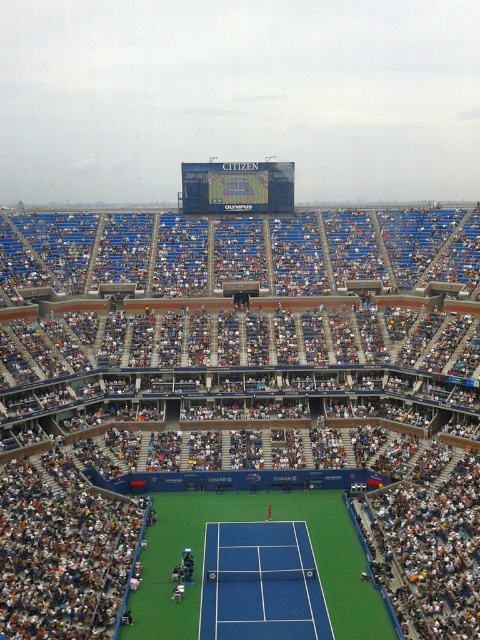
Is blue synthetic turf tennis court at center to the right of blue synthetic turf at center from the viewer's perspective?

Indeed, blue synthetic turf tennis court at center is positioned on the right side of blue synthetic turf at center.

Is blue synthetic turf tennis court at center bigger than blue synthetic turf at center?

No.

This screenshot has height=640, width=480. What do you see at coordinates (261, 582) in the screenshot?
I see `blue synthetic turf tennis court at center` at bounding box center [261, 582].

The width and height of the screenshot is (480, 640). In order to click on blue synthetic turf tennis court at center in this screenshot , I will do `click(261, 582)`.